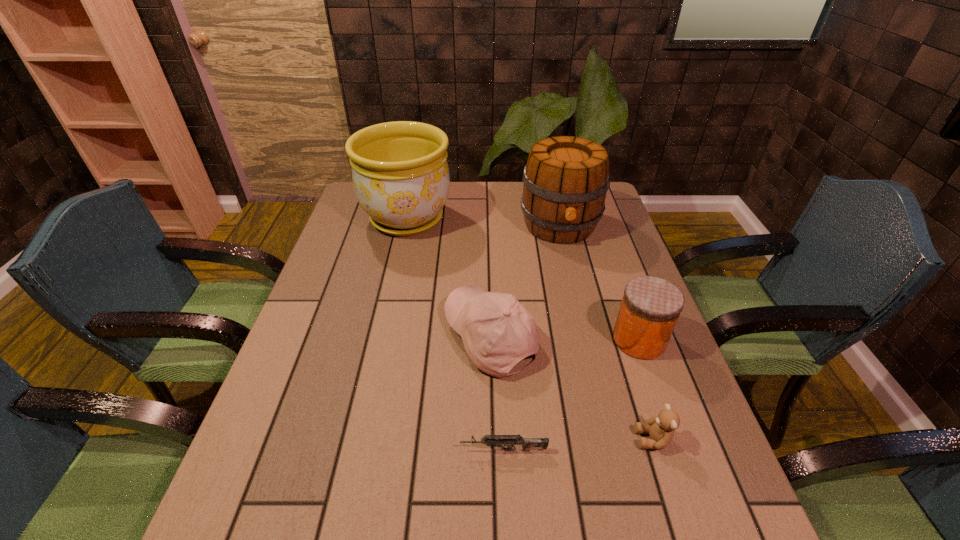
In order to click on object present at the left edge in this screenshot , I will do `click(400, 173)`.

Identify the location of cider at the right edge. Image resolution: width=960 pixels, height=540 pixels. (566, 179).

The image size is (960, 540). In order to click on jar located at the right edge in this screenshot , I will do `click(650, 308)`.

The height and width of the screenshot is (540, 960). I want to click on teddy bear located at the right edge, so click(x=661, y=429).

The image size is (960, 540). I want to click on object at the far left corner, so 400,173.

Find the location of a particular element. This screenshot has height=540, width=960. object present at the far right corner is located at coordinates (566, 179).

This screenshot has height=540, width=960. I want to click on vacant space at the far edge, so click(498, 210).

This screenshot has width=960, height=540. In the image, there is a desktop. Identify the location of free region at the near edge. (555, 525).

At what (x,y) coordinates should I click in order to perform the action: click on vacant space at the left edge of the desktop. Please return your answer as a coordinate pair (x, y). This screenshot has height=540, width=960. Looking at the image, I should click on (352, 275).

You are a GUI agent. You are given a task and a screenshot of the screen. Output one action in this format:
    pyautogui.click(x=<x>, y=<y>)
    Task: Click on the vacant region at the right edge of the desktop
    Image resolution: width=960 pixels, height=540 pixels.
    Given the screenshot: What is the action you would take?
    pyautogui.click(x=615, y=321)